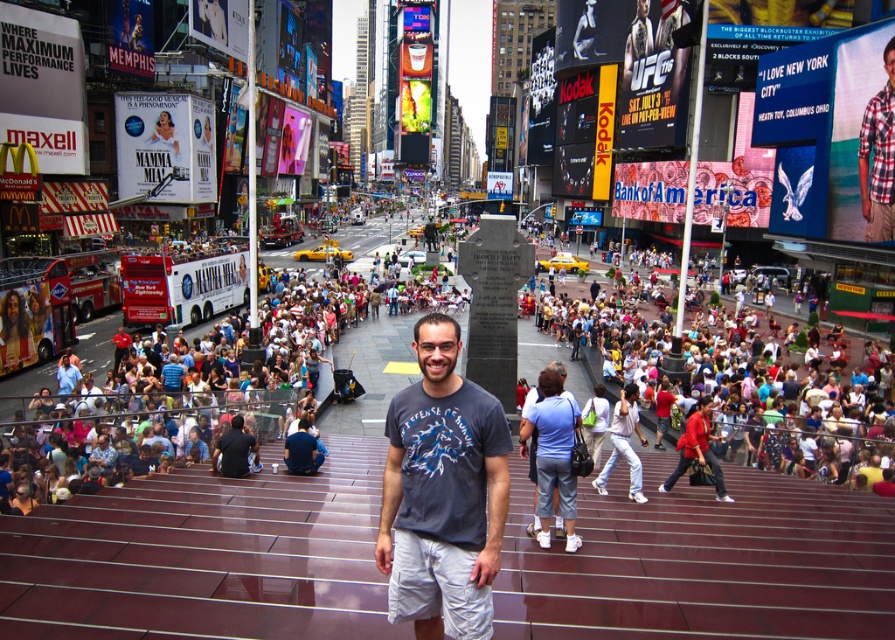
Question: Which of the following is the farthest from the observer?

Choices:
 (A) matte red coat at center
 (B) white cotton pants at center
 (C) dark gray t-shirt at center
 (D) plaid cotton shirt at upper right

Answer: (D)

Question: Which is nearer to the multicolored fabric crowd at center?

Choices:
 (A) light blue denim shorts at center
 (B) white cotton pants at center
 (C) dark gray t-shirt at center

Answer: (B)

Question: Which of the following is the farthest from the observer?

Choices:
 (A) (550, 486)
 (B) (872, 216)
 (C) (719, 468)
 (D) (397, 548)

Answer: (B)

Question: Is multicolored fabric crowd at center to the left of plaid cotton shirt at upper right from the viewer's perspective?

Choices:
 (A) yes
 (B) no

Answer: (A)

Question: Is dark gray t-shirt at center smaller than matte red coat at center?

Choices:
 (A) no
 (B) yes

Answer: (B)

Question: Is dark gray t-shirt at center below matte red coat at center?

Choices:
 (A) yes
 (B) no

Answer: (B)